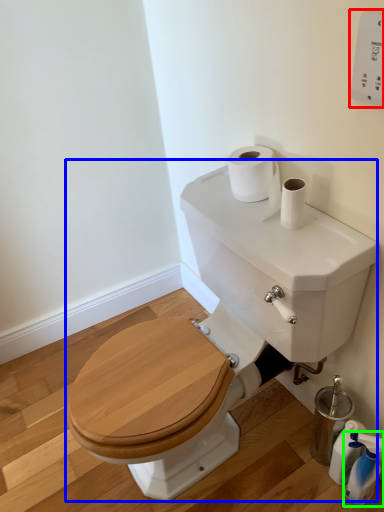
Question: Which object is positioned closest to electric outlet (highlighted by a red box)? Select from sink (highlighted by a blue box) and cleaning product (highlighted by a green box).

Choices:
 (A) sink
 (B) cleaning product

Answer: (A)